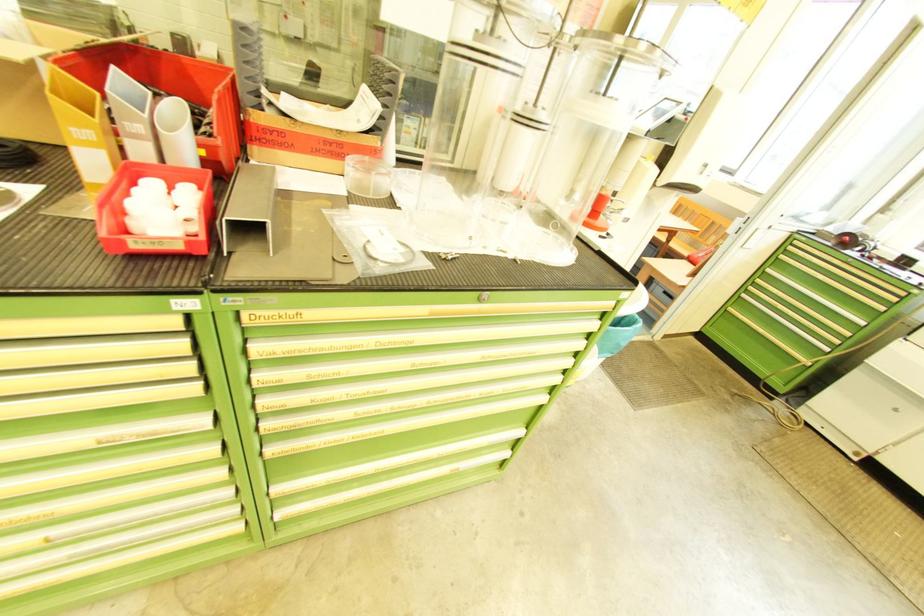
What are the coordinates of `cabinet keyhole` in the screenshot? It's located at (482, 296).